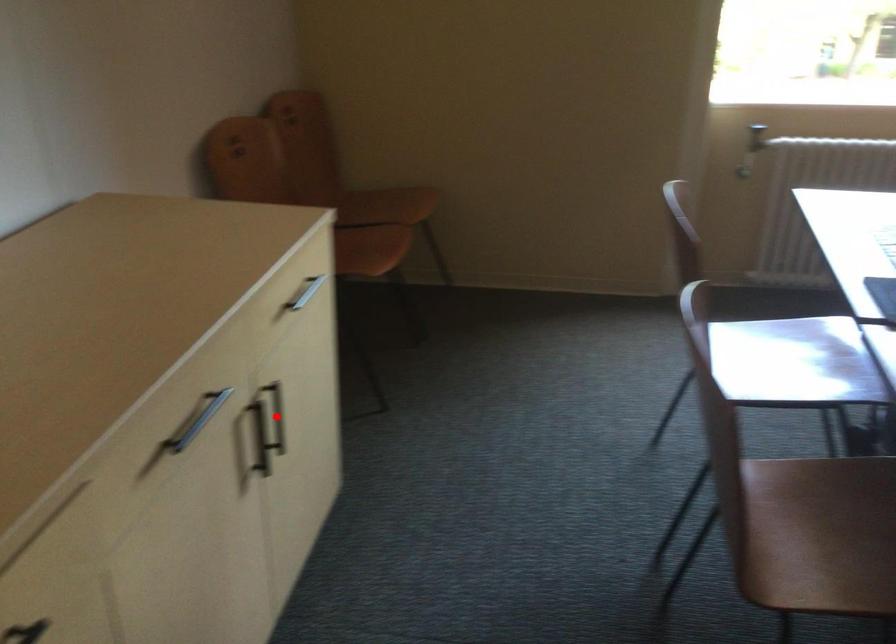
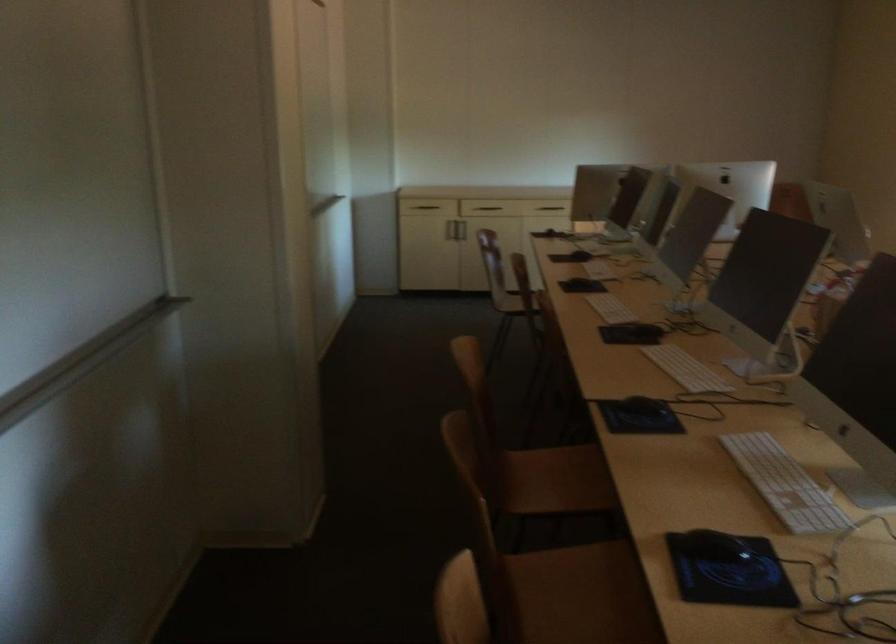
Question: I am providing you with two images of the same scene from different viewpoints. A red point is marked on the first image. At the location where the point appears in image 1, is it still visible in image 2?

Choices:
 (A) Yes
 (B) No

Answer: (B)